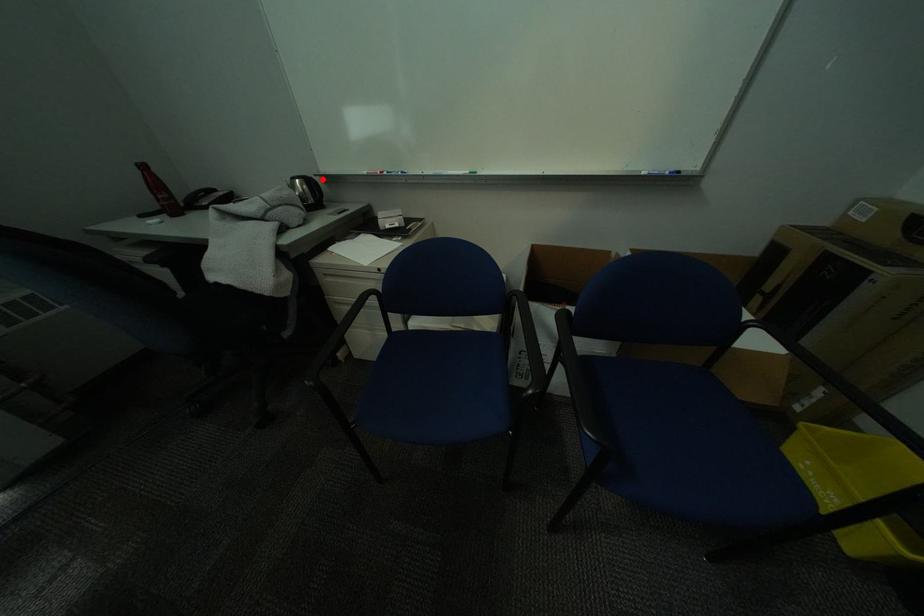
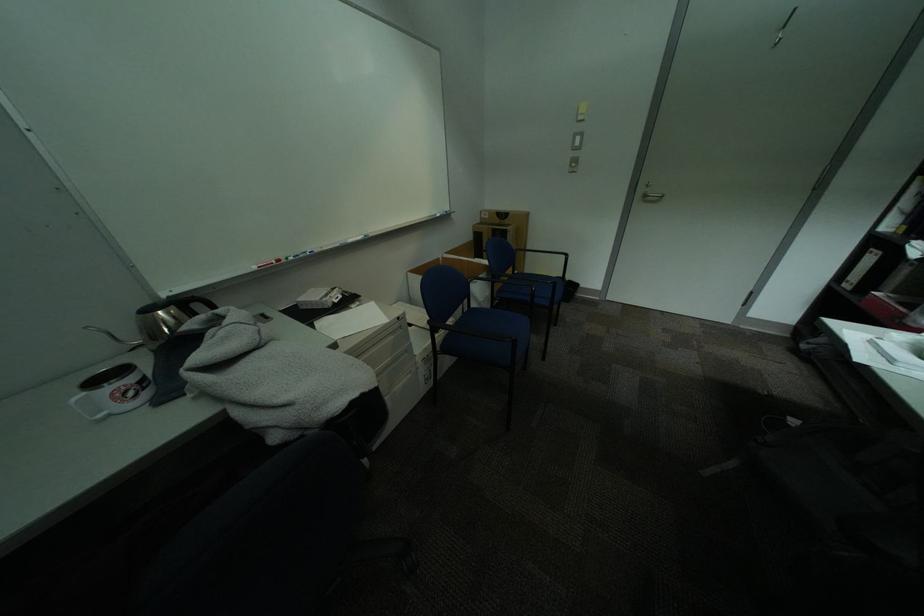
Question: I am providing you with two images of the same scene from different viewpoints. In image1, a red point is highlighted. Considering the same 3D point in image2, which of the following is correct?

Choices:
 (A) It is closer
 (B) It is farther

Answer: (B)